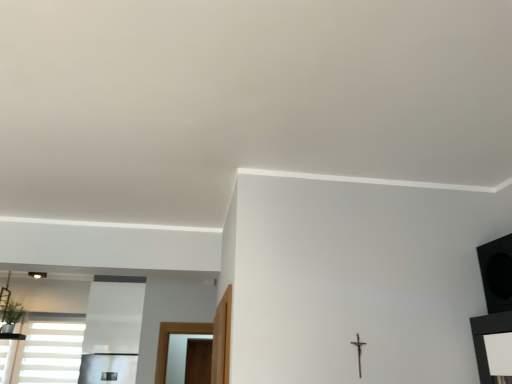
Find the location of a particular element. This screenshot has height=384, width=512. metallic crucifix at center-right is located at coordinates (358, 351).

Measure the distance between green leafy plant at lower left and camera.

4.84 meters.

Identify the location of white matte window at lower left. (46, 349).

Locate an element on the screen. This screenshot has width=512, height=384. metallic crucifix at center-right is located at coordinates (358, 351).

Where is `crucifix in front of the green leafy plant at lower left`? Image resolution: width=512 pixels, height=384 pixels. crucifix in front of the green leafy plant at lower left is located at coordinates (358, 351).

Between green leafy plant at lower left and metallic crucifix at center-right, which one has less height?

With less height is metallic crucifix at center-right.

Based on the photo, does green leafy plant at lower left contain metallic crucifix at center-right?

No, metallic crucifix at center-right is not a part of green leafy plant at lower left.

Find the location of `window behind the green leafy plant at lower left`. window behind the green leafy plant at lower left is located at coordinates (46, 349).

From a real-world perspective, who is located higher, green leafy plant at lower left or white matte window at lower left?

A: green leafy plant at lower left, from a real-world perspective.

From the image's perspective, relative to white matte window at lower left, is green leafy plant at lower left above or below?

Based on their image positions, green leafy plant at lower left is located above white matte window at lower left.

Is point (18, 319) farther from camera compared to point (8, 372)?

Yes, point (18, 319) is farther from viewer.

Could you tell me if metallic crucifix at center-right is facing white matte window at lower left?

No, metallic crucifix at center-right is not aimed at white matte window at lower left.

Would you say metallic crucifix at center-right is to the left or to the right of white matte window at lower left in the picture?

From the image, it's evident that metallic crucifix at center-right is to the right of white matte window at lower left.

Find the location of a particular element. Image resolution: width=512 pixels, height=384 pixels. window lying behind the metallic crucifix at center-right is located at coordinates (46, 349).

Is metallic crucifix at center-right next to white matte window at lower left?

No, metallic crucifix at center-right is not next to white matte window at lower left.

Is white matte window at lower left not inside green leafy plant at lower left?

Yes.

Image resolution: width=512 pixels, height=384 pixels. Find the location of `window on the left of the green leafy plant at lower left`. window on the left of the green leafy plant at lower left is located at coordinates (46, 349).

From the image's perspective, does white matte window at lower left appear lower than green leafy plant at lower left?

Correct, white matte window at lower left appears lower than green leafy plant at lower left in the image.

Measure the distance from metallic crucifix at center-right to green leafy plant at lower left.

metallic crucifix at center-right is 4.40 meters from green leafy plant at lower left.

Which is further, [362,344] or [21,303]?

The point [21,303] is farther.

Which of these two, metallic crucifix at center-right or green leafy plant at lower left, is thinner?

metallic crucifix at center-right.

Where is `crucifix on the right of white matte window at lower left`? The width and height of the screenshot is (512, 384). crucifix on the right of white matte window at lower left is located at coordinates (358, 351).

Does point (49, 349) come farther from viewer compared to point (360, 369)?

Yes.

From the image's perspective, is white matte window at lower left above metallic crucifix at center-right?

No.

Locate an element on the screen. crucifix located on the right of green leafy plant at lower left is located at coordinates (358, 351).

The width and height of the screenshot is (512, 384). I want to click on window that is below the green leafy plant at lower left (from the image's perspective), so click(x=46, y=349).

Which object lies further to the anchor point green leafy plant at lower left, white matte window at lower left or metallic crucifix at center-right?

metallic crucifix at center-right is further to green leafy plant at lower left.

Which object lies further to the anchor point metallic crucifix at center-right, green leafy plant at lower left or white matte window at lower left?

green leafy plant at lower left is positioned further to the anchor metallic crucifix at center-right.

When comparing their distances from green leafy plant at lower left, does metallic crucifix at center-right or white matte window at lower left seem closer?

white matte window at lower left is closer to green leafy plant at lower left.

When comparing their distances from white matte window at lower left, does metallic crucifix at center-right or green leafy plant at lower left seem closer?

green leafy plant at lower left is closer to white matte window at lower left.

When comparing their distances from white matte window at lower left, does green leafy plant at lower left or metallic crucifix at center-right seem closer?

Among the two, green leafy plant at lower left is located nearer to white matte window at lower left.

From the image, which object appears to be nearer to metallic crucifix at center-right, white matte window at lower left or green leafy plant at lower left?

white matte window at lower left lies closer to metallic crucifix at center-right than the other object.

The height and width of the screenshot is (384, 512). I want to click on plant between white matte window at lower left and metallic crucifix at center-right in the horizontal direction, so click(x=13, y=312).